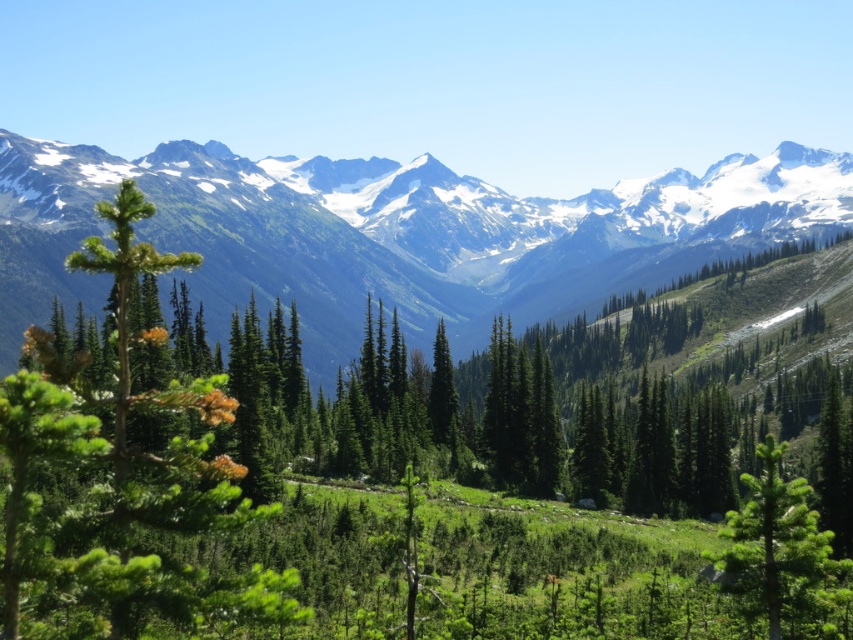
Question: Is green textured pine tree at center behind green needle-like tree at left?

Choices:
 (A) yes
 (B) no

Answer: (A)

Question: Does green textured pine tree at center appear over green textured pine trees at left?

Choices:
 (A) no
 (B) yes

Answer: (A)

Question: Can you confirm if green textured pine tree at center is positioned to the right of green needle-like tree at left?

Choices:
 (A) no
 (B) yes

Answer: (B)

Question: Which point is closer to the camera?

Choices:
 (A) (225, 467)
 (B) (311, 195)
 (C) (793, 500)

Answer: (A)

Question: Based on their relative distances, which object is farther from the green textured pine trees at left?

Choices:
 (A) green textured pine tree at center
 (B) green needle-like tree at left

Answer: (B)

Question: Based on their relative distances, which object is nearer to the green textured pine tree at center?

Choices:
 (A) green needle-like tree at center-right
 (B) green needle-like tree at left
 (C) green textured pine trees at left

Answer: (A)